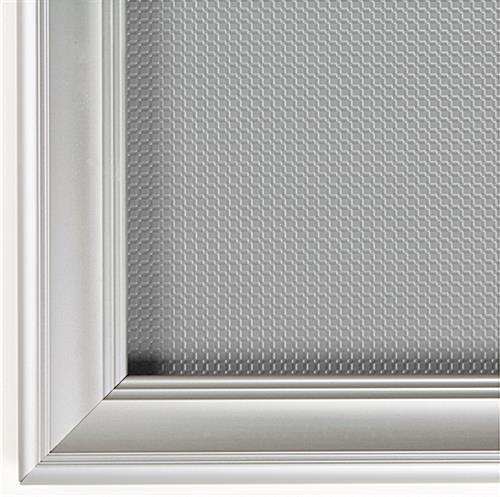
At what (x,y) coordinates should I click in order to perform the action: click on left panel of wood that makes up the frame. Please return your answer as a coordinate pair (x, y). This screenshot has width=500, height=497. Looking at the image, I should click on (77, 272).